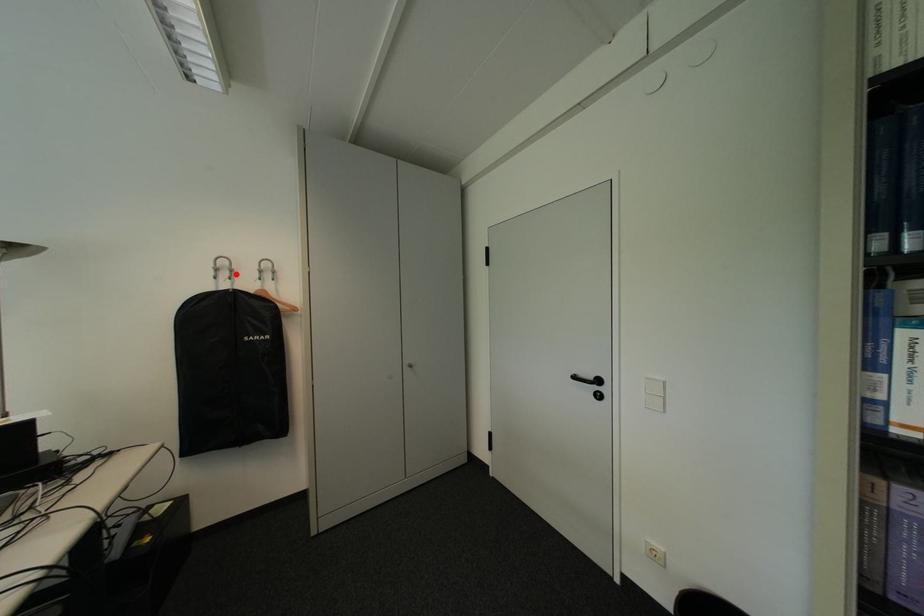
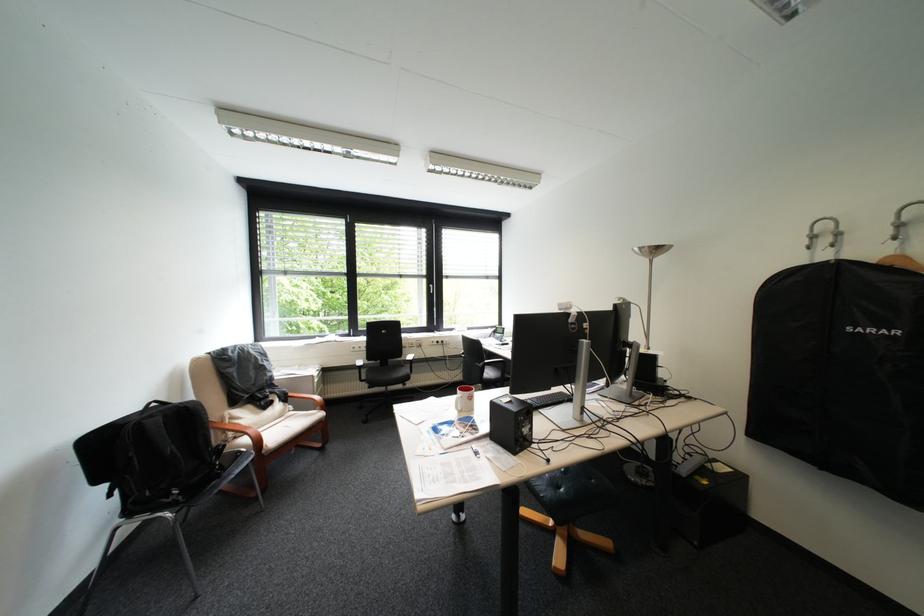
Question: I am providing you with two images of the same scene from different viewpoints. A red point is marked on the first image. At the location where the point appears in image 1, is it still visible in image 2?

Choices:
 (A) Yes
 (B) No

Answer: (A)